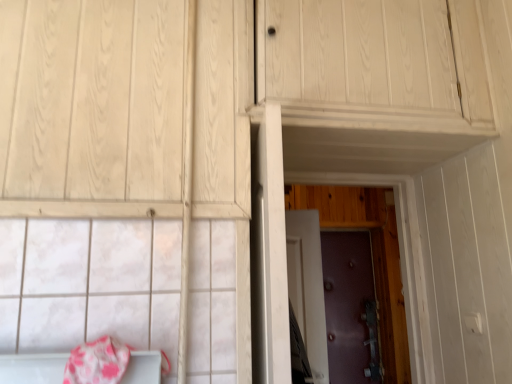
Question: From the image's perspective, is pink fabric blanket at lower left positioned above or below purple leather door at center, the first door positioned from the back?

Choices:
 (A) above
 (B) below

Answer: (A)

Question: Based on their positions, is pink fabric blanket at lower left located to the left or right of purple leather door at center, the first door positioned from the back?

Choices:
 (A) right
 (B) left

Answer: (B)

Question: Which is farther from the purple matte door at center, the second door from the back?

Choices:
 (A) purple textured door at center, arranged as the 3th door when viewed from the back
 (B) pink fabric blanket at lower left
 (C) purple leather door at center, the first door positioned from the back

Answer: (B)

Question: Based on their relative distances, which object is nearer to the purple matte door at center, the second door viewed from the front?

Choices:
 (A) purple textured door at center, arranged as the first door when viewed from the front
 (B) purple leather door at center, the first door positioned from the back
 (C) pink fabric blanket at lower left

Answer: (A)